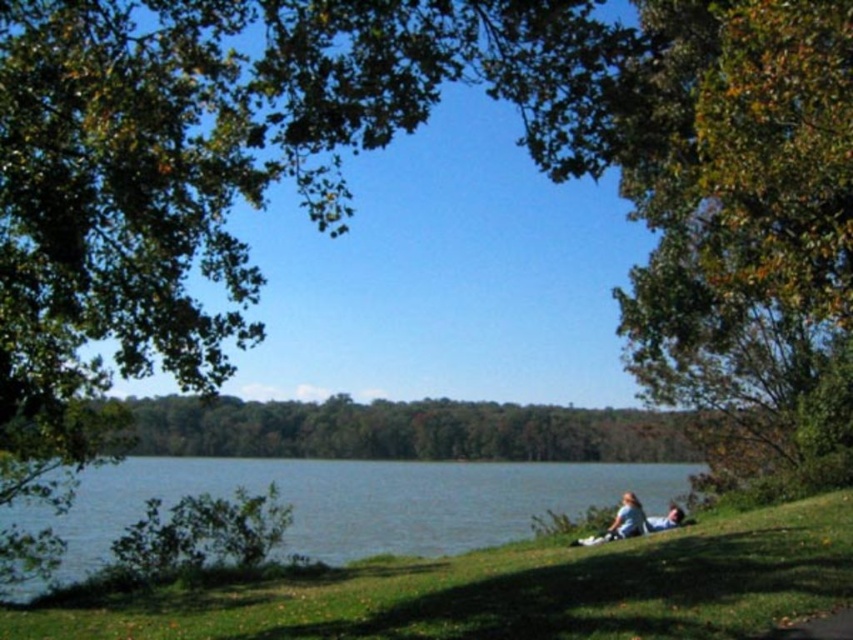
Is green leafy tree at right above blue water at lower left?

Indeed, green leafy tree at right is positioned over blue water at lower left.

Does green leafy tree at right have a larger size compared to blue water at lower left?

Correct, green leafy tree at right is larger in size than blue water at lower left.

This screenshot has width=853, height=640. What do you see at coordinates (747, 232) in the screenshot?
I see `green leafy tree at right` at bounding box center [747, 232].

Identify the location of green leafy tree at right. This screenshot has width=853, height=640. coord(747,232).

From the picture: Is green leafy tree at right wider than light blue fabric couple at lower right?

Indeed, green leafy tree at right has a greater width compared to light blue fabric couple at lower right.

Does green leafy tree at right lie in front of light blue fabric couple at lower right?

That is True.

The image size is (853, 640). What do you see at coordinates (747, 232) in the screenshot?
I see `green leafy tree at right` at bounding box center [747, 232].

The image size is (853, 640). In order to click on green leafy tree at right in this screenshot , I will do `click(747, 232)`.

Who is shorter, blue water at lower left or light blue fabric couple at lower right?

blue water at lower left is shorter.

Is blue water at lower left closer to the viewer compared to light blue fabric couple at lower right?

Yes, blue water at lower left is closer to the viewer.

Is point (108, 509) farther from viewer compared to point (676, 518)?

Yes, it is behind point (676, 518).

Locate an element on the screen. The height and width of the screenshot is (640, 853). blue water at lower left is located at coordinates (350, 500).